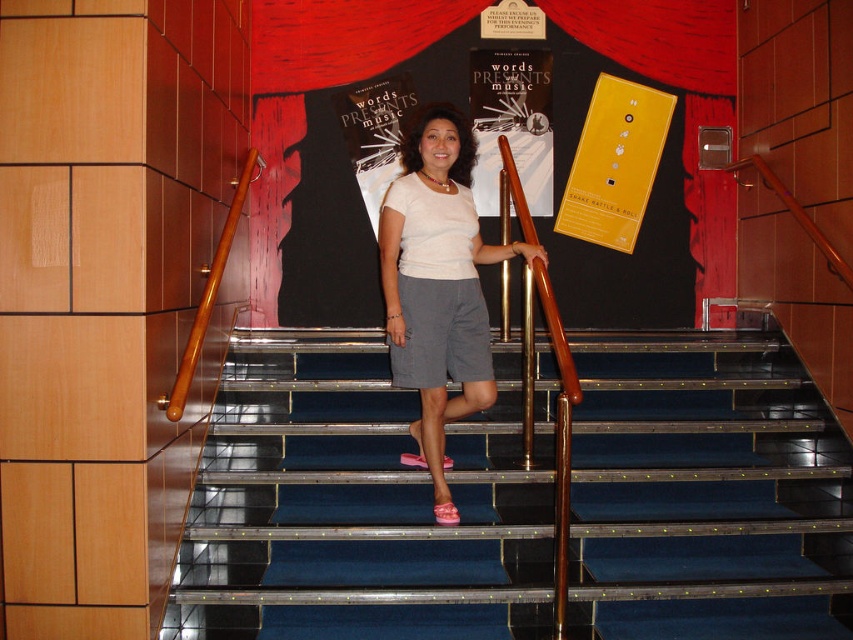
Looking at this image, between blue carpeted stairs at center and matte black poster at upper center, which one is positioned higher?

matte black poster at upper center

Does blue carpeted stairs at center appear under matte black poster at upper center?

Yes.

Does point (824, 413) come in front of point (689, 236)?

Yes.

Locate an element on the screen. The image size is (853, 640). blue carpeted stairs at center is located at coordinates (361, 504).

Can you confirm if yellow matte poster at upper center is bigger than matte paper poster at center?

Actually, yellow matte poster at upper center might be smaller than matte paper poster at center.

Is yellow matte poster at upper center smaller than matte paper poster at center?

Indeed, yellow matte poster at upper center has a smaller size compared to matte paper poster at center.

Where is `yellow matte poster at upper center`? The width and height of the screenshot is (853, 640). yellow matte poster at upper center is located at coordinates (614, 163).

What are the coordinates of `yellow matte poster at upper center` in the screenshot? It's located at (614, 163).

Who is more forward, (491, 152) or (401, 300)?

Positioned in front is point (401, 300).

I want to click on matte paper poster at center, so click(512, 124).

This screenshot has width=853, height=640. I want to click on matte paper poster at center, so click(512, 124).